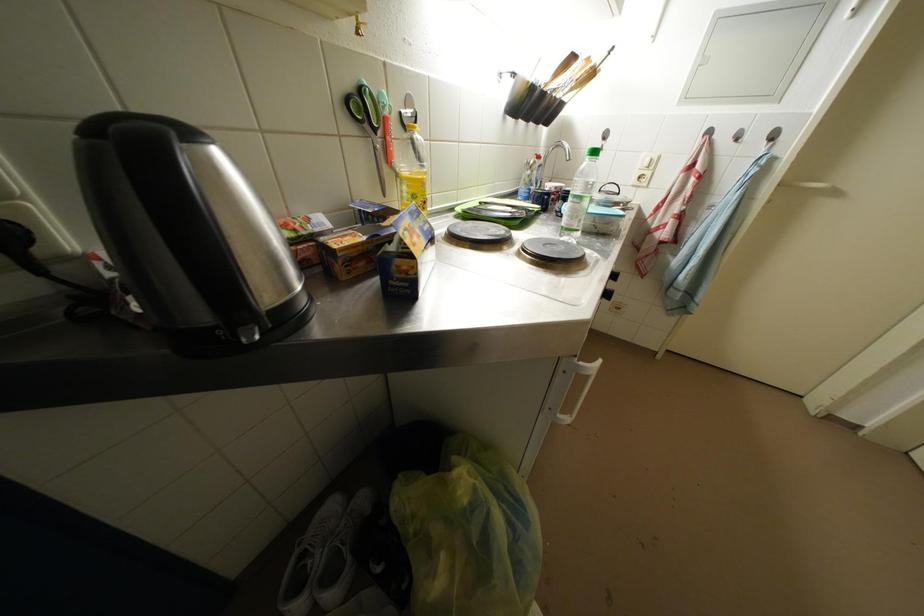
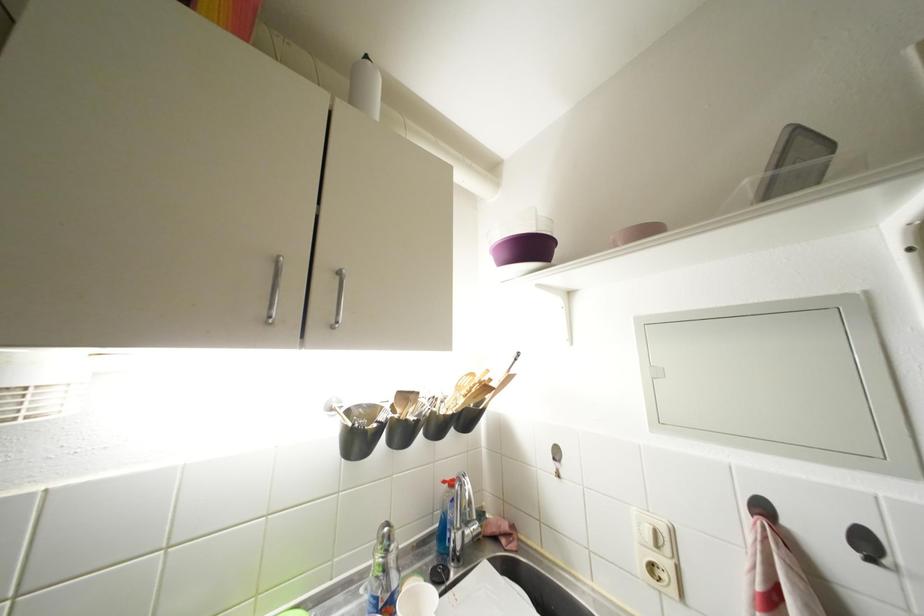
Where in the second image is the point corresponding to (x=716, y=137) from the first image?

(770, 513)